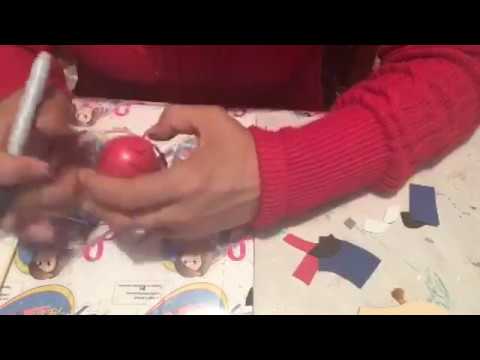
Image resolution: width=480 pixels, height=360 pixels. I want to click on pen, so click(27, 114).